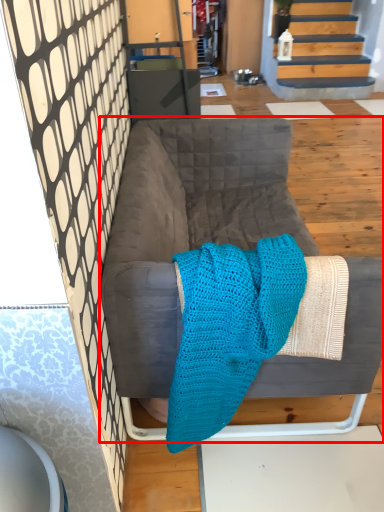
Question: From the image's perspective, where is furniture (annotated by the red box) located relative to cloth?

Choices:
 (A) below
 (B) above

Answer: (B)